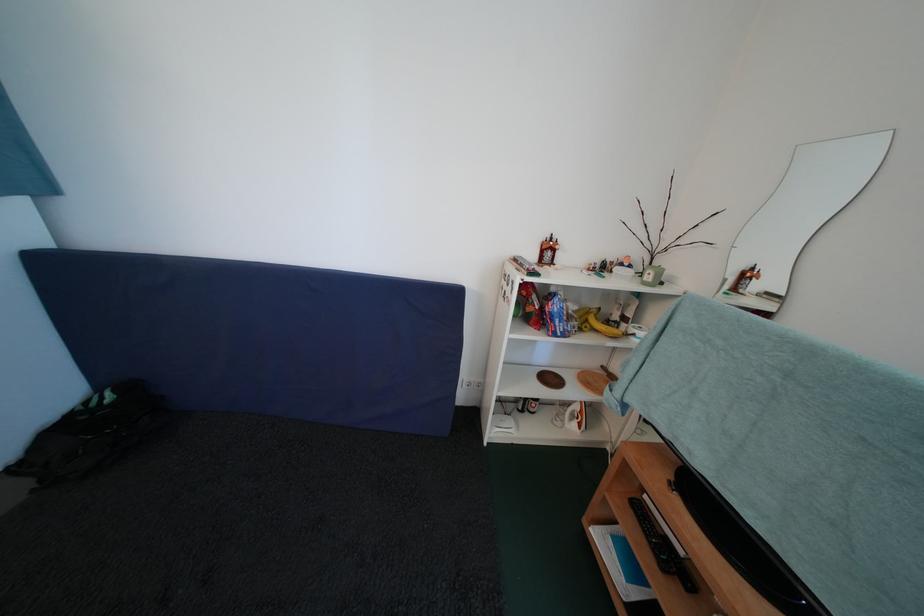
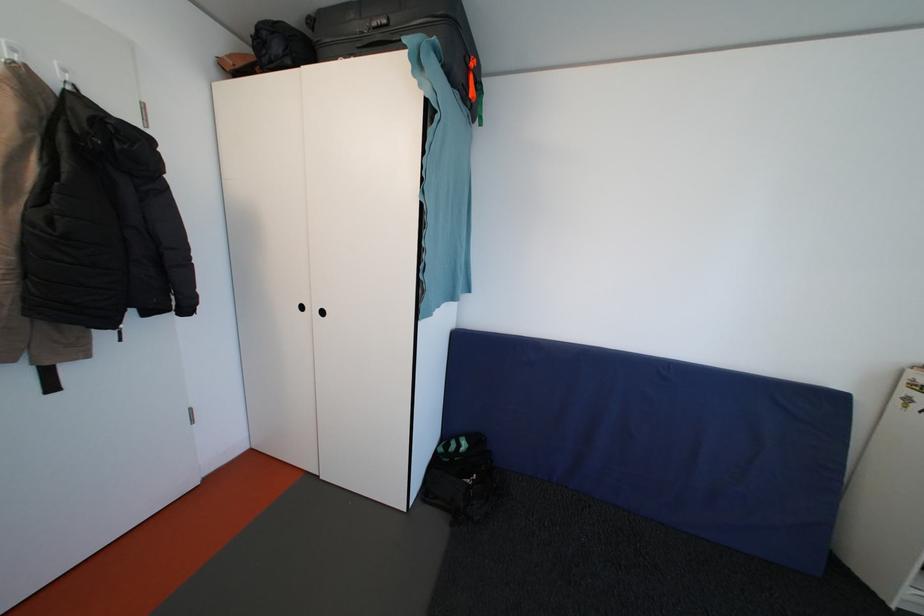
Question: What movement of the cameraman would produce the second image?

Choices:
 (A) Left
 (B) Right
 (C) Forward
 (D) Backward

Answer: (A)